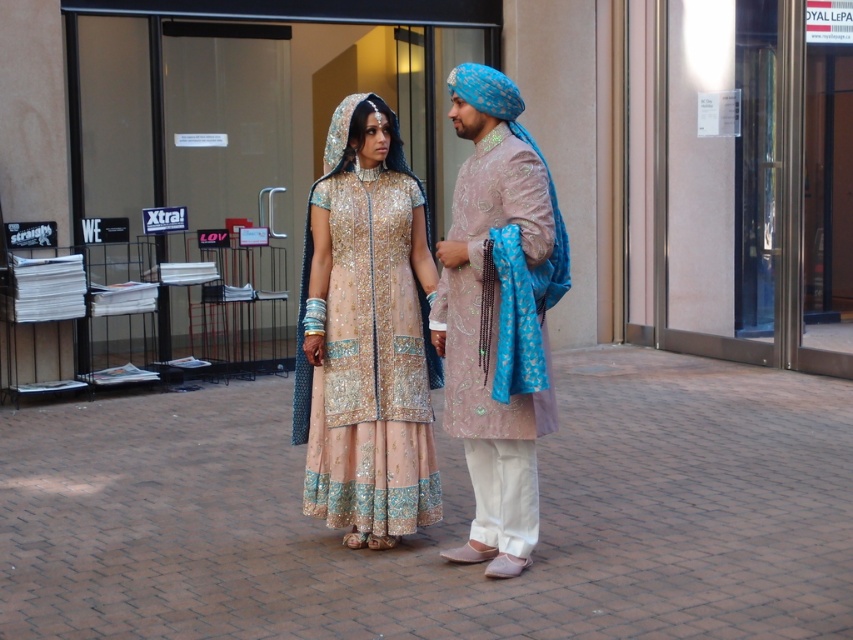
Question: Which of the following is the farthest from the observer?

Choices:
 (A) (799, 452)
 (B) (492, 506)

Answer: (A)

Question: Which of the following is the farthest from the observer?

Choices:
 (A) (427, 307)
 (B) (532, 291)

Answer: (A)

Question: Does brick pavement at center appear on the left side of matte pink kurta at center?

Choices:
 (A) yes
 (B) no

Answer: (A)

Question: Does matte pink kurta at center have a lesser width compared to pale pink embroidered dress at center?

Choices:
 (A) no
 (B) yes

Answer: (B)

Question: Can you confirm if brick pavement at center is wider than matte pink kurta at center?

Choices:
 (A) yes
 (B) no

Answer: (A)

Question: Which object is farther from the camera taking this photo?

Choices:
 (A) brick pavement at center
 (B) matte pink kurta at center

Answer: (A)